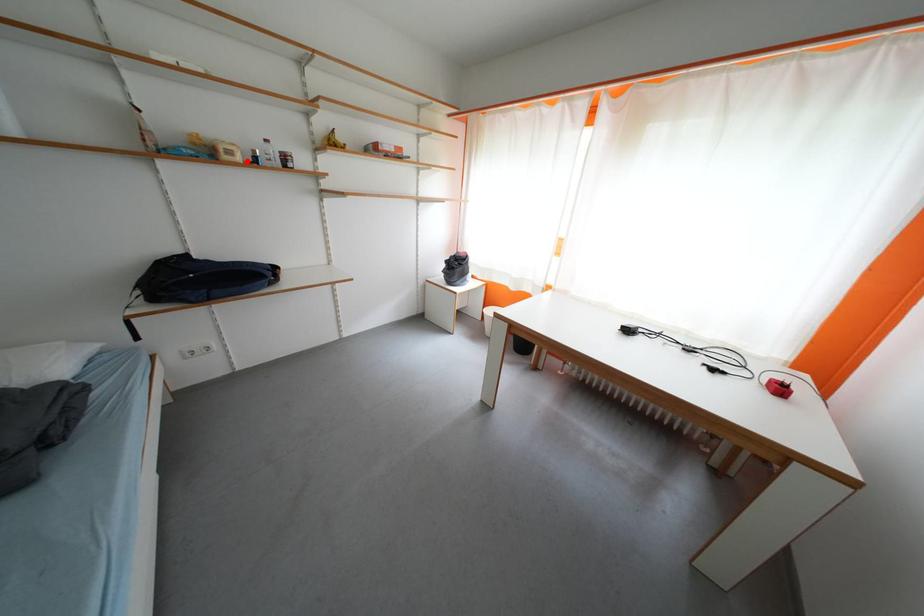
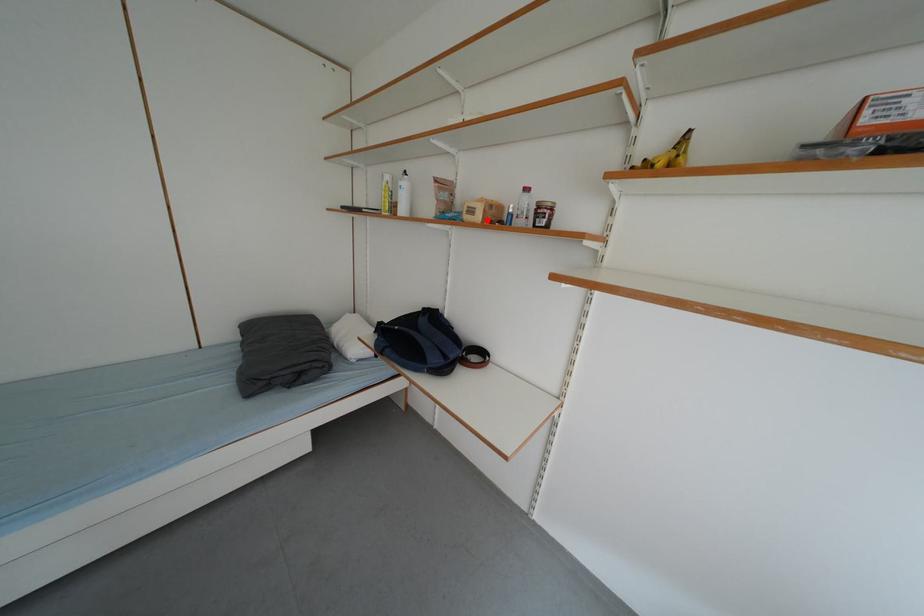
I am providing you with two images of the same scene from different viewpoints. A red point is marked on the first image and another point is marked on the second image. Does the point marked in image1 correspond to the same location as the one in image2?

Yes